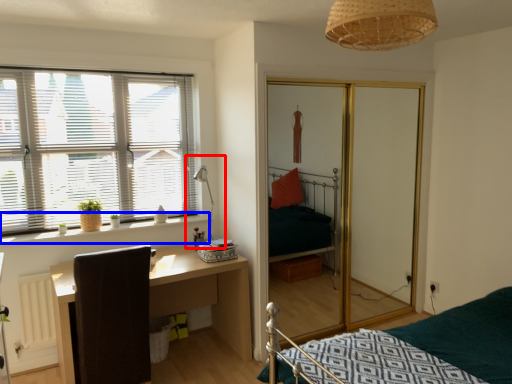
Question: Which of the following is the closest to the observer, table lamp (highlighted by a red box) or window sill (highlighted by a blue box)?

Choices:
 (A) table lamp
 (B) window sill

Answer: (B)